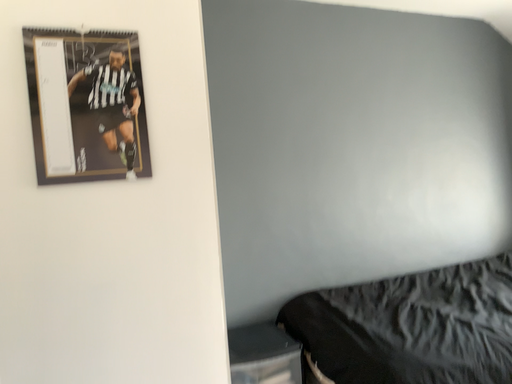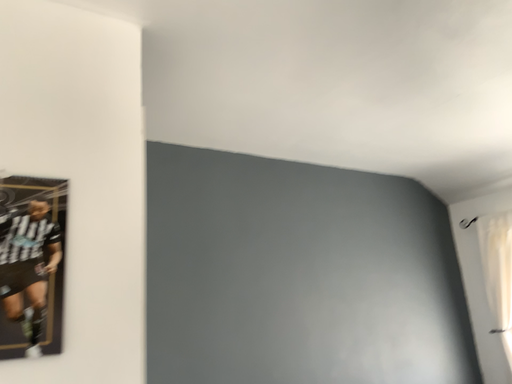
Question: How did the camera likely rotate when shooting the video?

Choices:
 (A) rotated right
 (B) rotated left

Answer: (A)